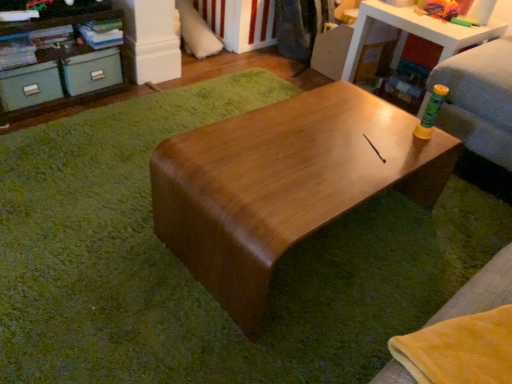
This screenshot has height=384, width=512. Find the location of `vacant space in front of matte green drawer at left, the first drawer positioned from the left`. vacant space in front of matte green drawer at left, the first drawer positioned from the left is located at coordinates (29, 131).